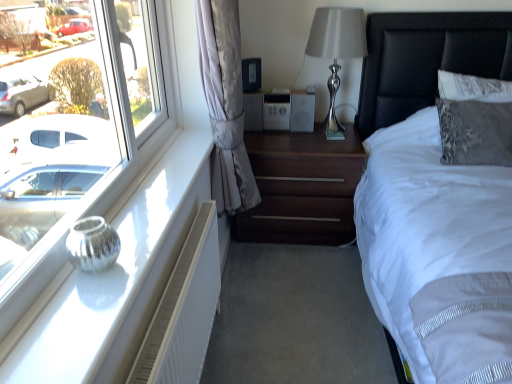
Question: From a real-world perspective, relative to white fabric bed at right, is satin silver lamp at upper right vertically above or below?

Choices:
 (A) above
 (B) below

Answer: (A)

Question: Looking at their shapes, would you say satin silver lamp at upper right is wider or thinner than white fabric bed at right?

Choices:
 (A) thin
 (B) wide

Answer: (A)

Question: Which object is positioned closest to the dark wood nightstand at center?

Choices:
 (A) black leather headboard at upper right
 (B) satin fabric curtain at lower left
 (C) white fabric bed at right
 (D) satin silver lamp at upper right
 (E) white textured radiator at lower left

Answer: (B)

Question: Which is farther from the satin silver lamp at upper right?

Choices:
 (A) satin fabric curtain at lower left
 (B) white fabric bed at right
 (C) black leather headboard at upper right
 (D) silver metallic vase at left
 (E) dark wood nightstand at center

Answer: (D)